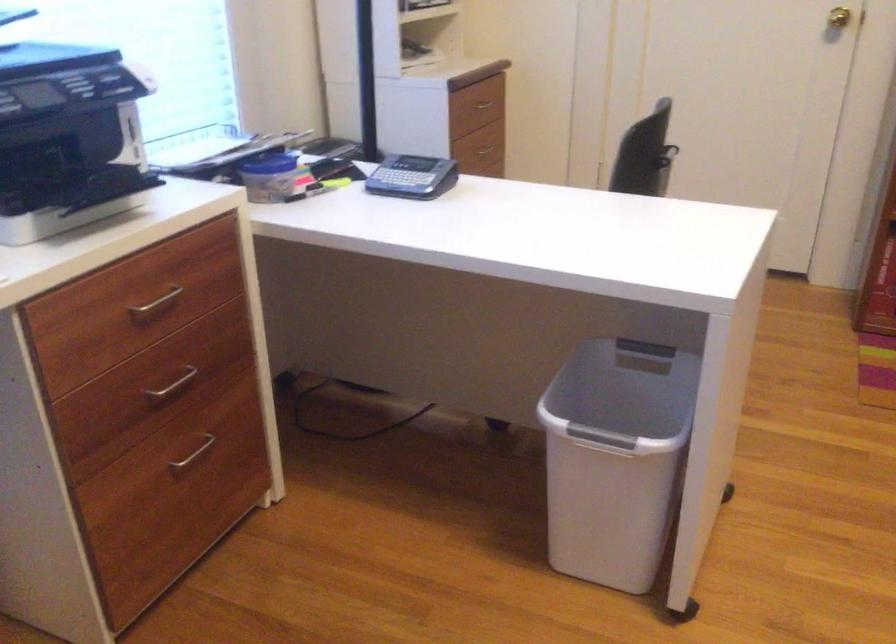
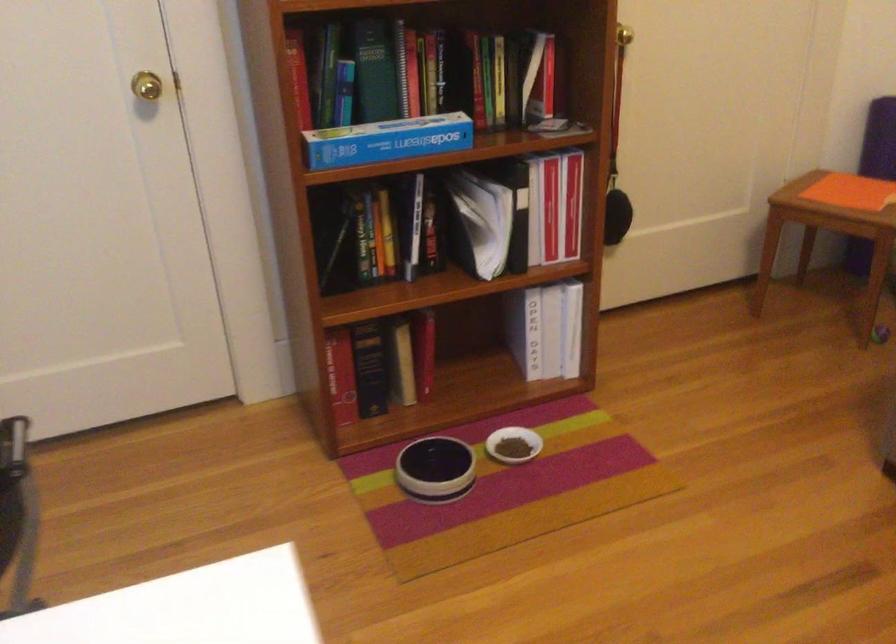
Question: The camera is either moving clockwise (left) or counter-clockwise (right) around the object. The first image is from the beginning of the video and the second image is from the end. Is the camera moving left or right when shooting the video?

Choices:
 (A) Left
 (B) Right

Answer: (A)